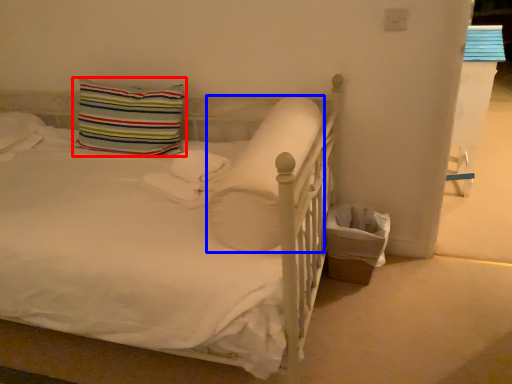
Question: Which object appears farthest to the camera in this image, pillow (highlighted by a red box) or pillow (highlighted by a blue box)?

Choices:
 (A) pillow
 (B) pillow

Answer: (A)